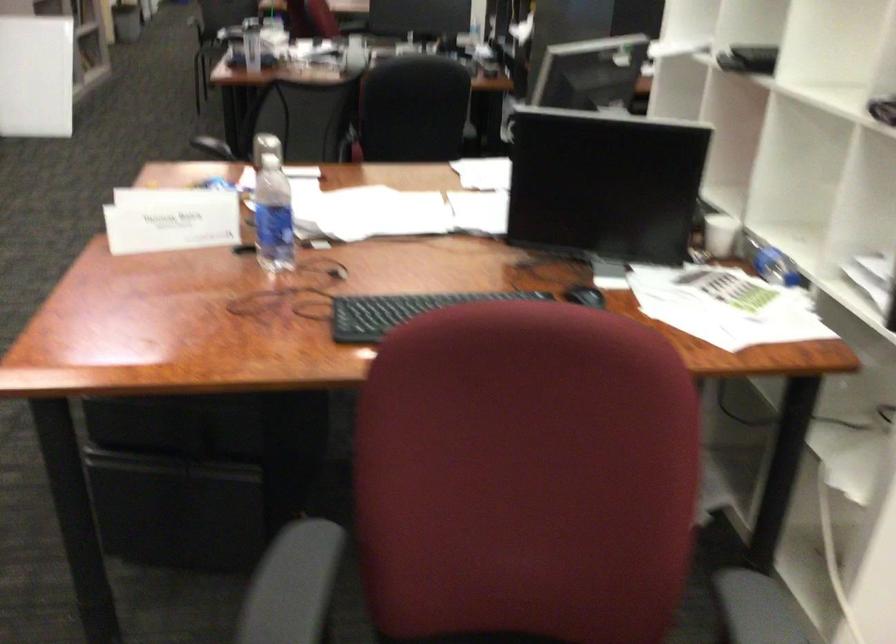
This screenshot has height=644, width=896. What do you see at coordinates (293, 585) in the screenshot? I see `the grey chair armrest` at bounding box center [293, 585].